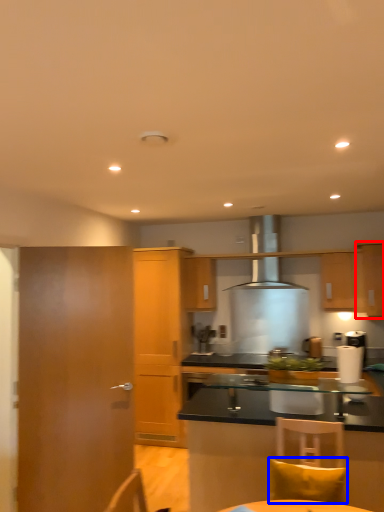
Question: Which object appears farthest to the camera in this image, cabinetry (highlighted by a red box) or pillow (highlighted by a blue box)?

Choices:
 (A) cabinetry
 (B) pillow

Answer: (A)